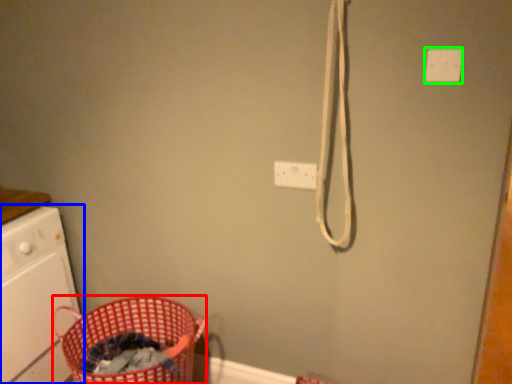
Question: Which is farther away from basket (highlighted by a red box)? home appliance (highlighted by a blue box) or light switch (highlighted by a green box)?

Choices:
 (A) home appliance
 (B) light switch

Answer: (B)